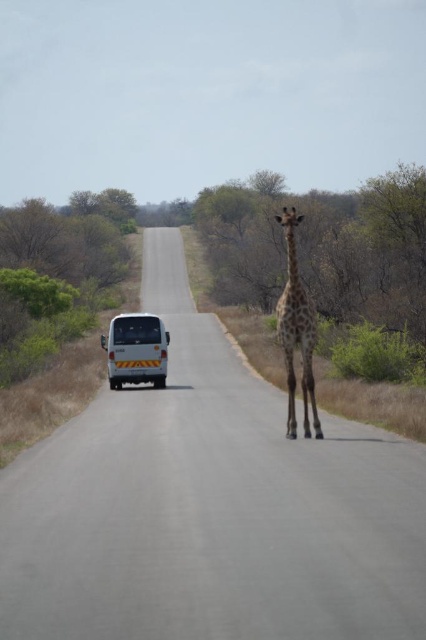
Who is higher up, spotted fur giraffe at center or white matte van at center?

Positioned higher is spotted fur giraffe at center.

Is spotted fur giraffe at center thinner than white matte van at center?

Incorrect, spotted fur giraffe at center's width is not less than white matte van at center's.

Between point (302, 316) and point (155, 380), which one is positioned in front?

Point (302, 316) is in front.

I want to click on spotted fur giraffe at center, so click(x=296, y=332).